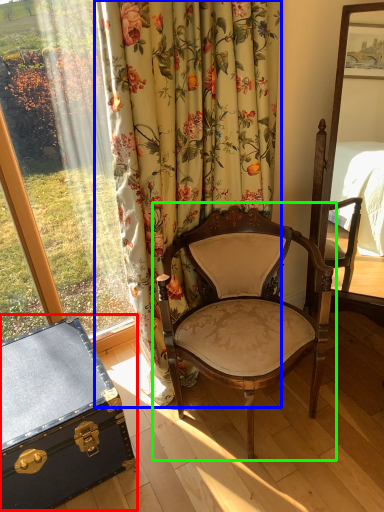
Question: Estimate the real-world distances between objects in this image. Which object is farther from chest (highlighted by a red box), curtain (highlighted by a blue box) or chair (highlighted by a green box)?

Choices:
 (A) curtain
 (B) chair

Answer: (A)